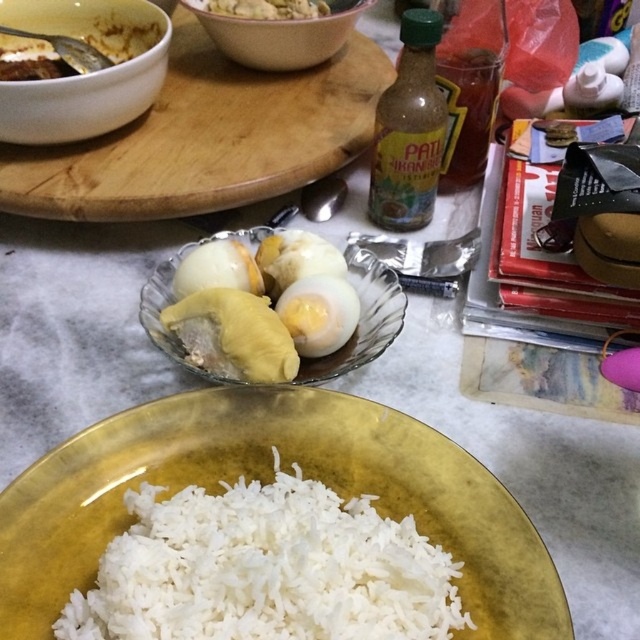
In the scene shown: You are a chef arranging a buffet table and need to place the yellow matte durian at center and the pink ceramic bowl at upper center. According to the current setup, which item is blocking the view of the other?

The pink ceramic bowl at upper center is blocking the view of the yellow matte durian at center because it is placed in front of it.

You are preparing to place a lid on either the pink ceramic bowl at upper center or the yellow matte durian at center. Which object requires a wider lid to cover it properly?

The pink ceramic bowl at upper center might be wider than the yellow matte durian at center, so it would require a wider lid to cover it properly.

You are arranging a dinner table and need to place the pink ceramic bowl at upper center and the smooth white rice at bottom. According to the image, which item is positioned lower on the table?

The pink ceramic bowl at upper center is below smooth white rice at bottom, so the pink ceramic bowl at upper center is positioned lower on the table.